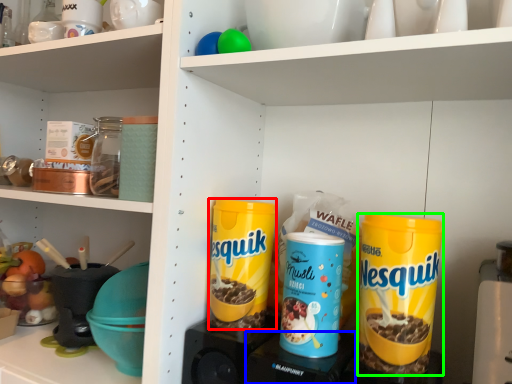
Question: Which object is positioned farthest from cereal (highlighted by a red box)? Select from appliance (highlighted by a blue box) and cereal (highlighted by a green box).

Choices:
 (A) appliance
 (B) cereal

Answer: (B)